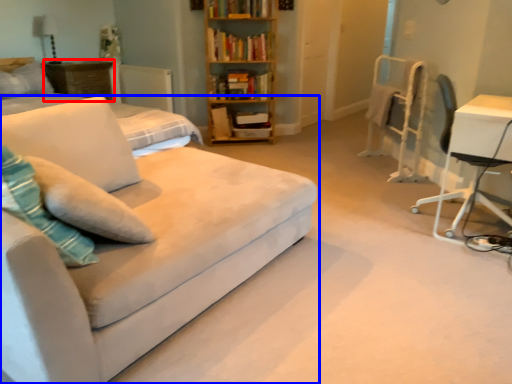
Question: Which of the following is the farthest to the observer, table (highlighted by a red box) or studio couch (highlighted by a blue box)?

Choices:
 (A) table
 (B) studio couch

Answer: (A)